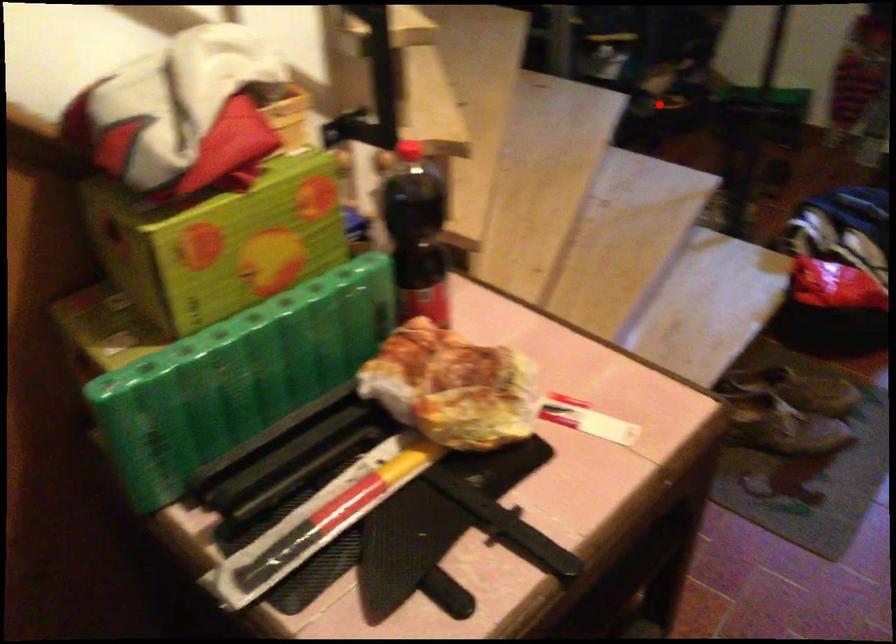
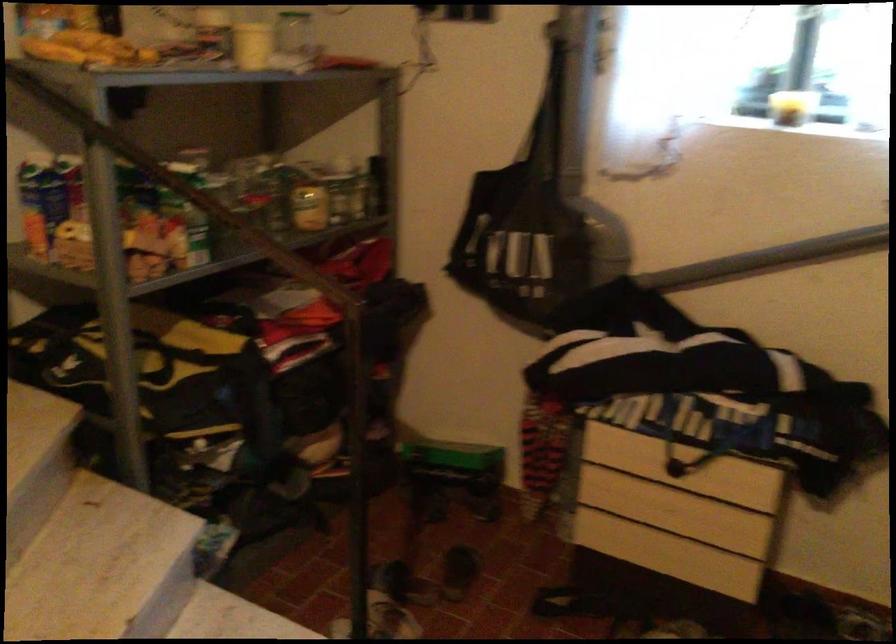
Question: I am providing you with two images of the same scene from different viewpoints. Given a red point in image1, look at the same physical point in image2. Is it:

Choices:
 (A) Closer to the viewpoint
 (B) Farther from the viewpoint

Answer: (A)